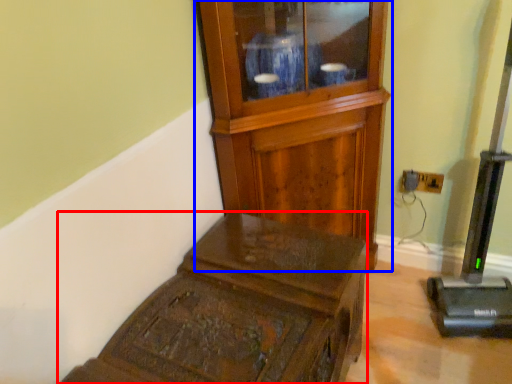
Question: Which of the following is the farthest to the observer, furniture (highlighted by a red box) or side cabinet (highlighted by a blue box)?

Choices:
 (A) furniture
 (B) side cabinet

Answer: (B)